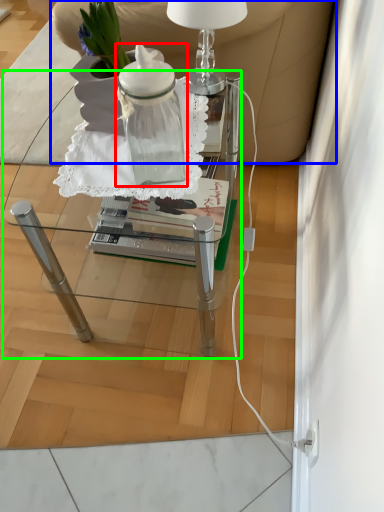
Question: Which object is the farthest from bottle (highlighted by a red box)? Choose among these: armchair (highlighted by a blue box) or table (highlighted by a green box).

Choices:
 (A) armchair
 (B) table

Answer: (A)